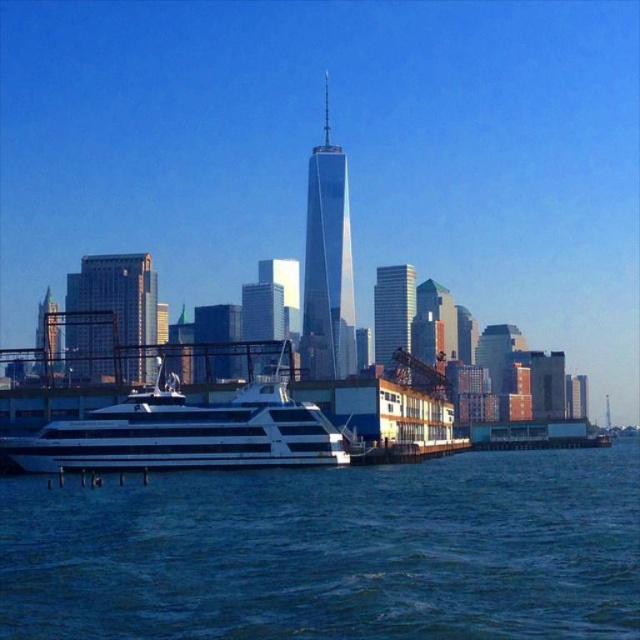
Question: Which object is the farthest from the gold glass skyscraper at center?

Choices:
 (A) shiny glass skyscraper at center
 (B) blue water at lower center

Answer: (A)

Question: Which of the following is the farthest from the observer?

Choices:
 (A) (150, 342)
 (B) (333, 376)

Answer: (B)

Question: Which of the following is the closest to the observer?

Choices:
 (A) white glossy cruise ship at lower left
 (B) glassy reflective skyscraper at center
 (C) shiny glass skyscraper at center

Answer: (A)

Question: Is white glossy cruise ship at lower left bigger than glassy steel skyscraper at center?

Choices:
 (A) yes
 (B) no

Answer: (B)

Question: Is blue water at lower center positioned at the back of white glossy cruise ship at lower left?

Choices:
 (A) no
 (B) yes

Answer: (A)

Question: Can you confirm if white glossy cruise ship at lower left is bigger than gold glass skyscraper at center?

Choices:
 (A) yes
 (B) no

Answer: (B)